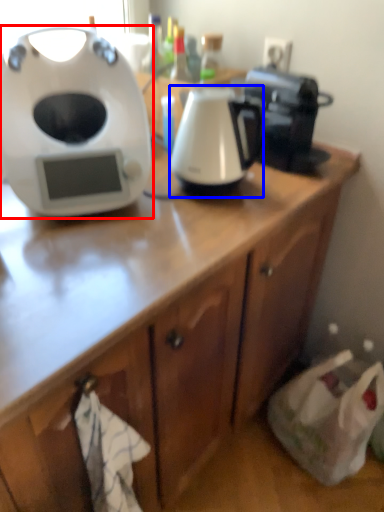
Question: Which point is further to the camera, home appliance (highlighted by a red box) or kitchen appliance (highlighted by a blue box)?

Choices:
 (A) home appliance
 (B) kitchen appliance

Answer: (B)